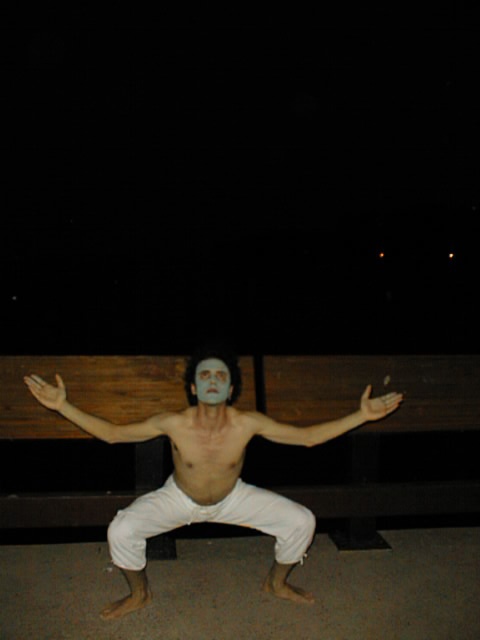
Which is behind, point (244, 428) or point (61, 403)?

The point (61, 403) is behind.

Which is more to the left, smooth skin torso at center or pale skin/soft flesh at center?

pale skin/soft flesh at center is more to the left.

Is point (253, 420) closer to viewer compared to point (109, 422)?

Yes, it is.

Identify the location of smooth skin torso at center. Image resolution: width=480 pixels, height=640 pixels. (207, 449).

Can you confirm if white cotton pants at center is positioned above smooth matte face at center?

No, white cotton pants at center is not above smooth matte face at center.

Find the location of `white cotton pants at center`. white cotton pants at center is located at coordinates (208, 476).

Image resolution: width=480 pixels, height=640 pixels. I want to click on white cotton pants at center, so click(x=208, y=476).

Does matte white arm at center have a greater height compared to pale skin/soft flesh at center?

No, matte white arm at center is not taller than pale skin/soft flesh at center.

The width and height of the screenshot is (480, 640). I want to click on matte white arm at center, so click(x=324, y=422).

You are a GUI agent. You are given a task and a screenshot of the screen. Output one action in this format:
    pyautogui.click(x=<x>, y=<y>)
    Task: Click on the matte white arm at center
    Image resolution: width=480 pixels, height=640 pixels.
    Given the screenshot: What is the action you would take?
    pyautogui.click(x=324, y=422)